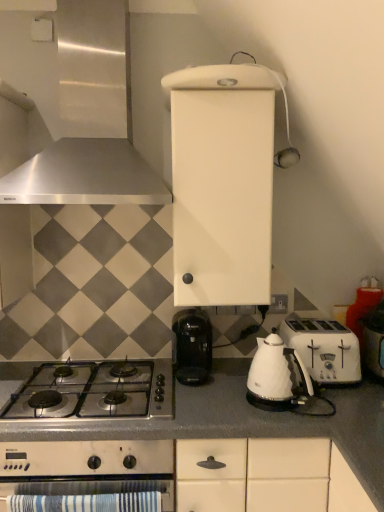
Locate an element on the screen. The width and height of the screenshot is (384, 512). vacant area that is in front of white plastic toaster at right is located at coordinates (342, 400).